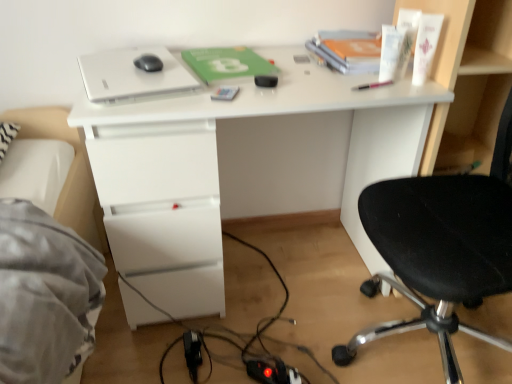
In order to click on vacant space behind metallic silver phone at center, positioned as the 2th stationery in right-to-left order in this screenshot , I will do `click(239, 79)`.